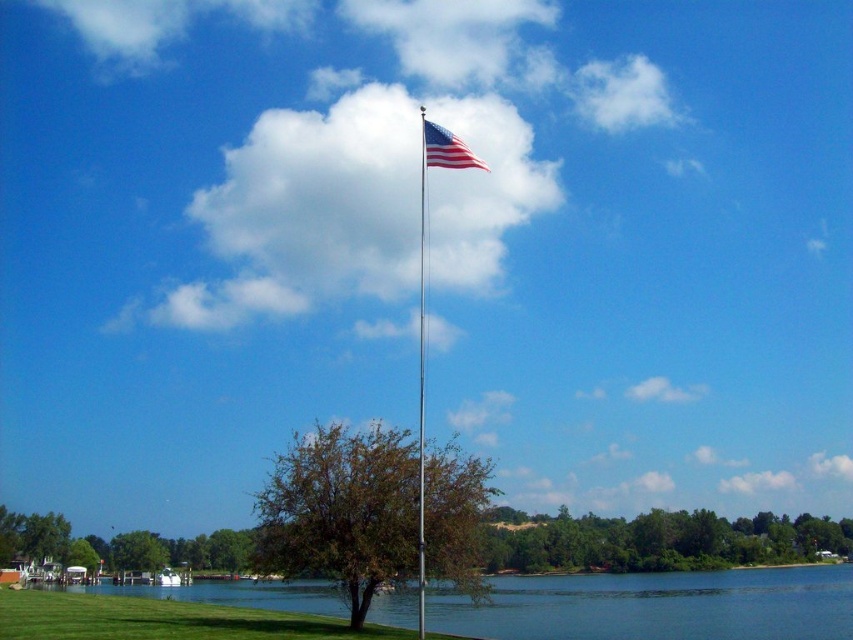
You are standing at the lakeside and want to take a photo of the brown textured tree at center. The camera you have can focus on objects up to 30 meters away. Will the tree be in focus?

The brown textured tree at center is 30.53 meters from camera, which is beyond the camera focus limit of 30 meters. The tree will not be in focus.

You are planning to take a photo of the brown textured tree at center and the american flag at upper center. Which object will appear smaller in the photo?

The brown textured tree at center will appear smaller in the photo because it occupies less space than the american flag at upper center.